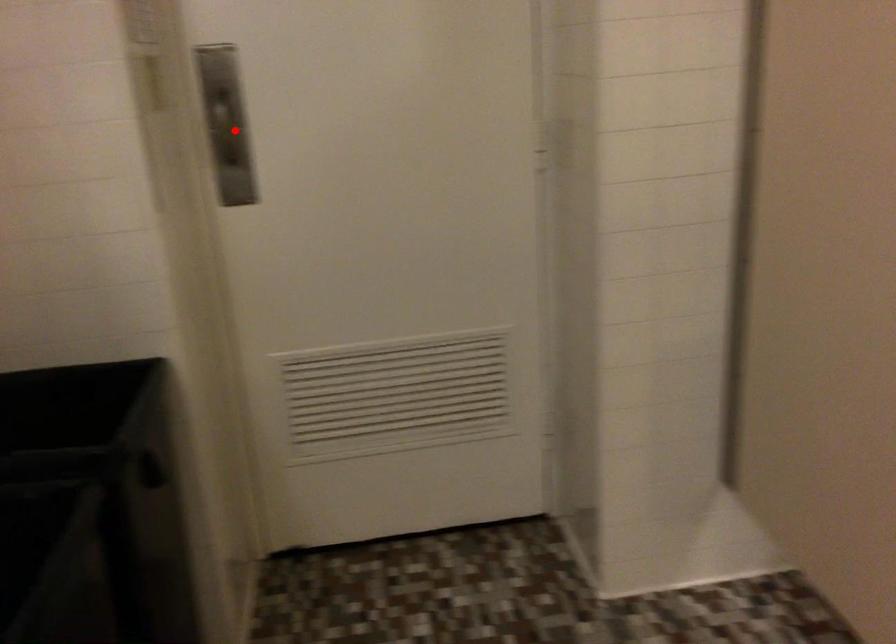
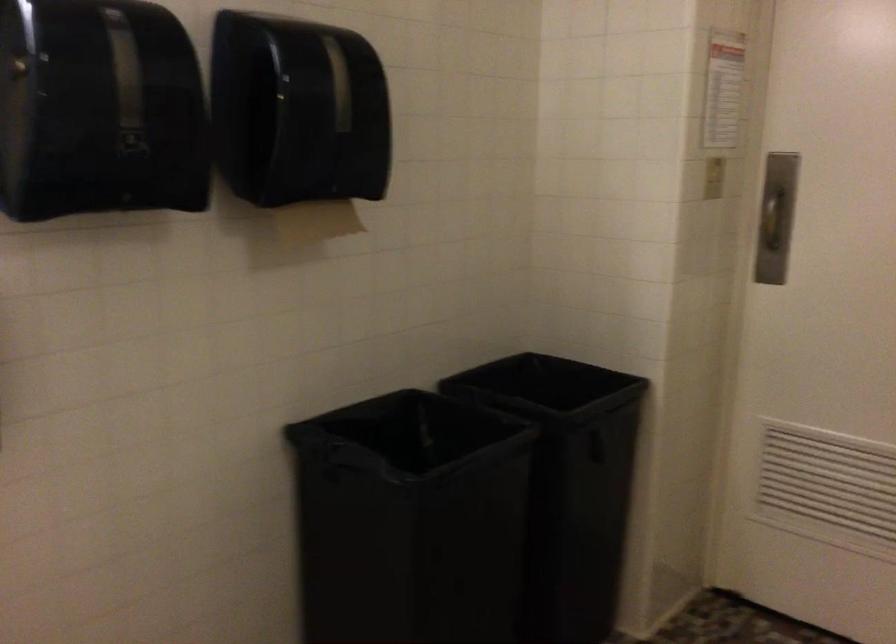
Find the pixel in the second image that matches the highlighted location in the first image.

(776, 216)